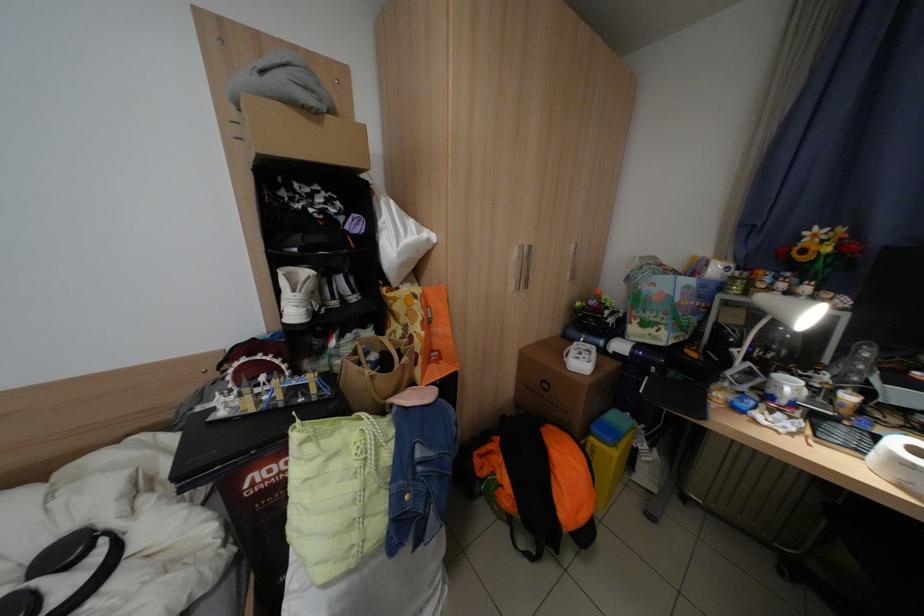
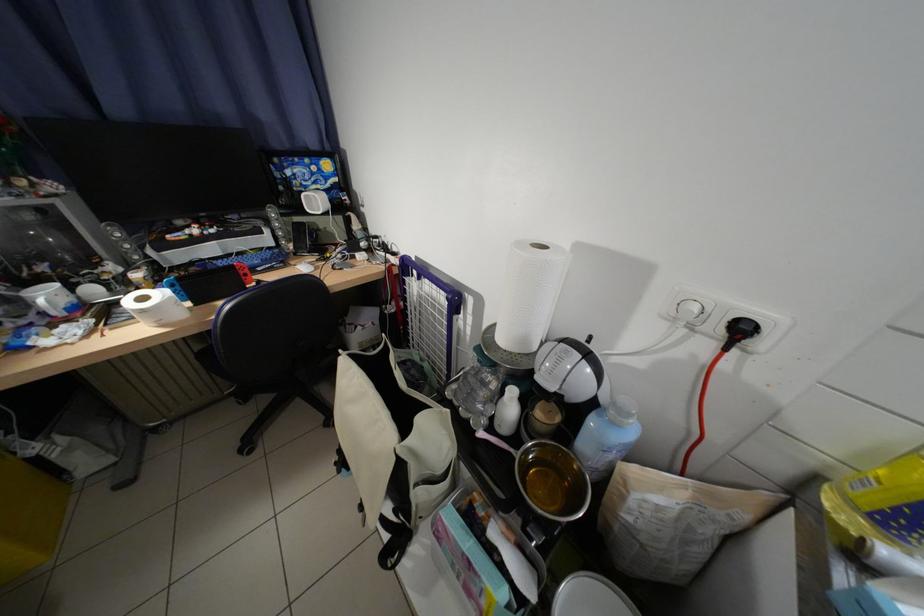
Where in the second image is the point corresponding to point 800,387 from the first image?

(59, 297)